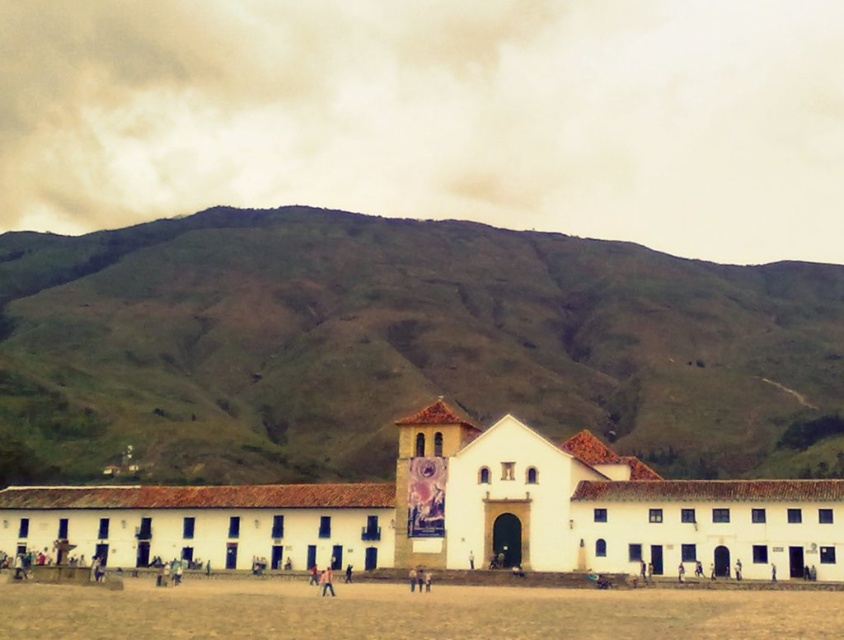
Based on the photo, you are a photographer planning to take a photo of the white matte building at center and the brown sandy dirt field at lower center. Based on their relative heights, which object should you focus on first to ensure both are in frame without cropping?

The white matte building at center is much taller than the brown sandy dirt field at lower center, so you should focus on the white matte building at center first to ensure its full height is captured before adjusting for the field.

You are standing in front of the large white colonial building with a red roof. You need to place a small garden in the brown sandy dirt field at lower center. Where exactly should you place it?

The brown sandy dirt field at lower center is located at point (410, 612), so you should place the garden there.